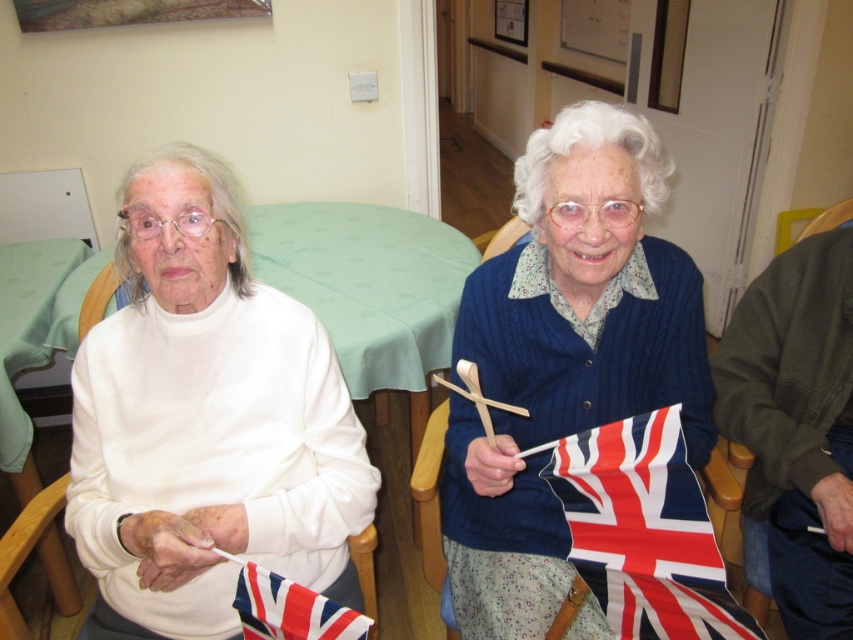
Question: Does white cotton sweater at left appear on the right side of union jack fabric flag at lower left?

Choices:
 (A) no
 (B) yes

Answer: (B)

Question: In this image, where is red and white fabric flag at center located relative to union jack fabric flag at lower left?

Choices:
 (A) below
 (B) above

Answer: (A)

Question: Which of these objects is positioned farthest from the wooden chair at center?

Choices:
 (A) blue knitted sweater at center
 (B) wooden chair at lower left
 (C) white cotton sweater at left

Answer: (B)

Question: Can you confirm if white matte turtleneck sweater at left is positioned below blue knitted sweater at center?

Choices:
 (A) no
 (B) yes

Answer: (A)

Question: Which object is farther from the camera taking this photo?

Choices:
 (A) wooden chair at center
 (B) blue knitted sweater at center

Answer: (B)

Question: Estimate the real-world distances between objects in this image. Which object is farther from the blue knitted sweater at center?

Choices:
 (A) union jack fabric flag at lower left
 (B) red and white fabric flag at center
 (C) wooden chair at lower left

Answer: (C)